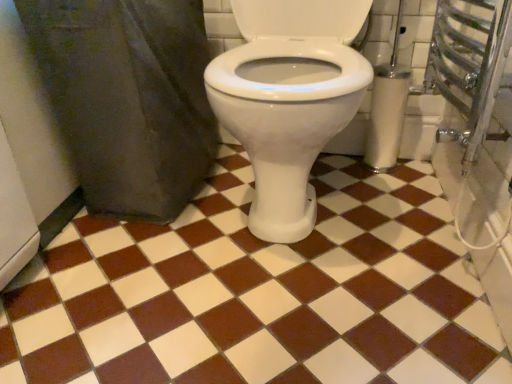
The height and width of the screenshot is (384, 512). Find the location of `blank space situated above white glossy tile at center (from a real-world perspective)`. blank space situated above white glossy tile at center (from a real-world perspective) is located at coordinates click(258, 252).